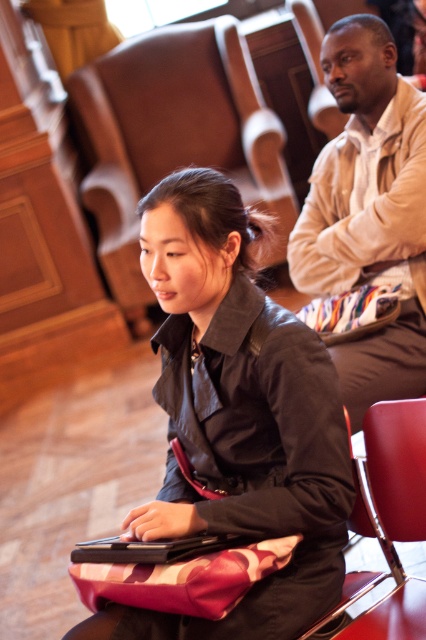
Question: Which object is positioned farthest from the smooth leather armchair at lower right?

Choices:
 (A) black matte laptop at center
 (B) leather armchair at center
 (C) light beige shirt at upper right

Answer: (B)

Question: Can you confirm if light beige shirt at upper right is positioned to the left of black matte laptop at center?

Choices:
 (A) no
 (B) yes

Answer: (A)

Question: Is light beige shirt at upper right to the right of smooth leather armchair at lower right from the viewer's perspective?

Choices:
 (A) yes
 (B) no

Answer: (A)

Question: Which is nearer to the light beige shirt at upper right?

Choices:
 (A) matte black jacket at center
 (B) black matte laptop at center
 (C) smooth leather armchair at lower right
 (D) leather armchair at center

Answer: (A)

Question: Estimate the real-world distances between objects in this image. Which object is farther from the smooth leather armchair at lower right?

Choices:
 (A) black matte laptop at center
 (B) light beige shirt at upper right
 (C) leather armchair at center

Answer: (C)

Question: Is leather armchair at center below light beige shirt at upper right?

Choices:
 (A) yes
 (B) no

Answer: (B)